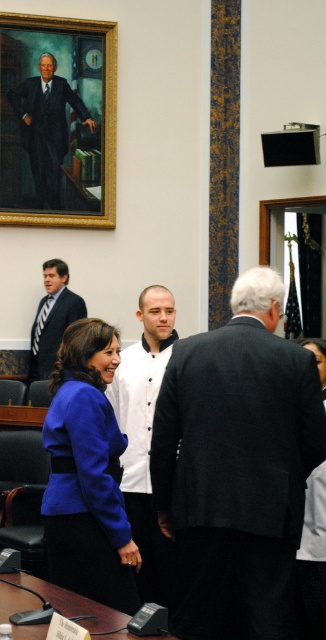
Question: Which object is positioned closest to the black textured suit at center?

Choices:
 (A) white matte shirt at center
 (B) dark blue matte business suit at upper left
 (C) smooth black table at lower center

Answer: (C)

Question: Does black textured suit at center have a lesser width compared to smooth black table at lower center?

Choices:
 (A) no
 (B) yes

Answer: (A)

Question: Estimate the real-world distances between objects in this image. Which object is closer to the matte black suit at left?

Choices:
 (A) goldframed portrait at upper left
 (B) dark blue matte business suit at upper left
 (C) blue fabric dress at center

Answer: (A)

Question: Which point is closer to the camera?

Choices:
 (A) (53, 269)
 (B) (19, 93)

Answer: (A)

Question: Does blue woolen jacket at center come behind blue fabric dress at center?

Choices:
 (A) no
 (B) yes

Answer: (A)

Question: Is goldframed portrait at upper left bigger than smooth black table at lower center?

Choices:
 (A) no
 (B) yes

Answer: (B)